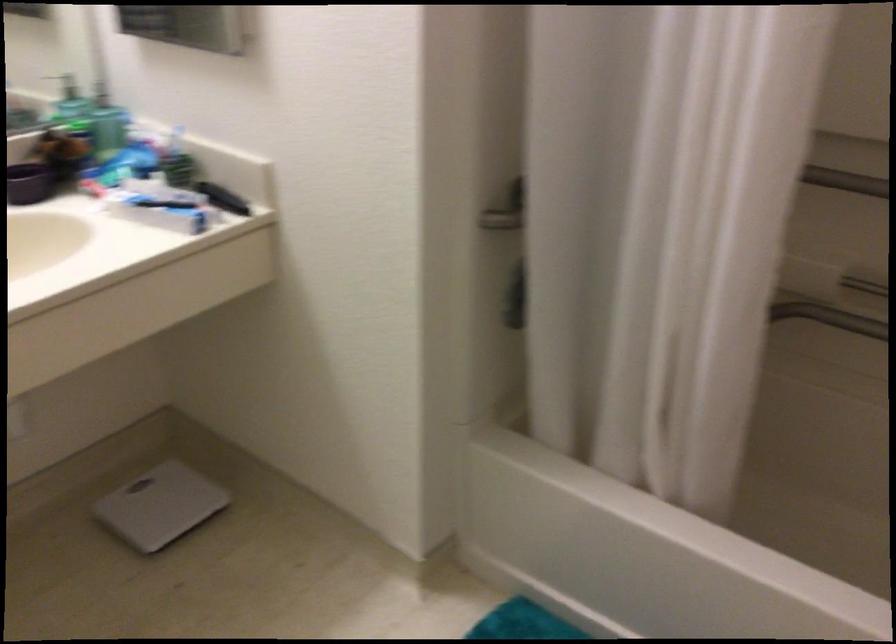
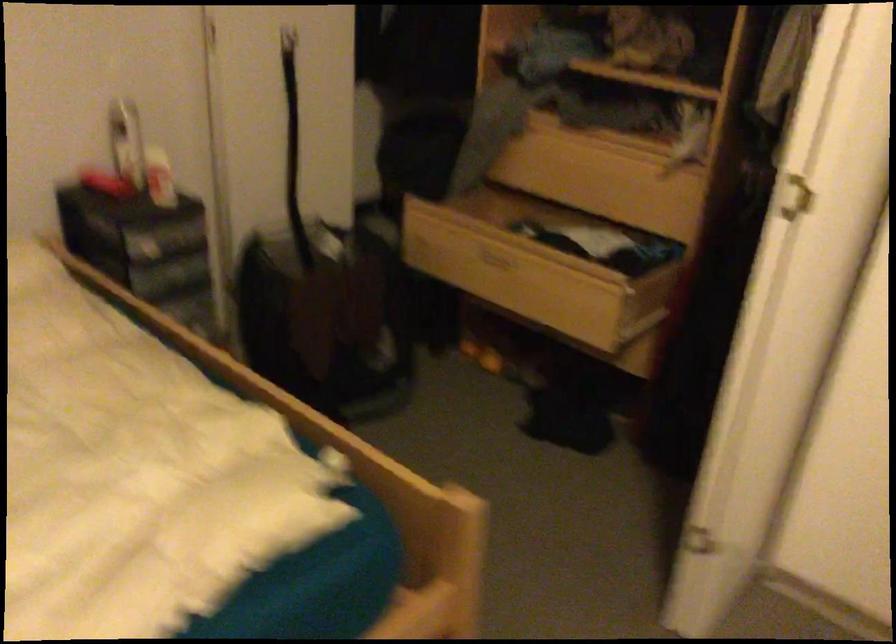
Question: I am providing you with two images of the same scene from different viewpoints. Please identify which objects are invisible in image2.

Choices:
 (A) blue folding seat
 (B) open wooden drawer
 (C) white bathroom scale
 (D) white door handle

Answer: (C)